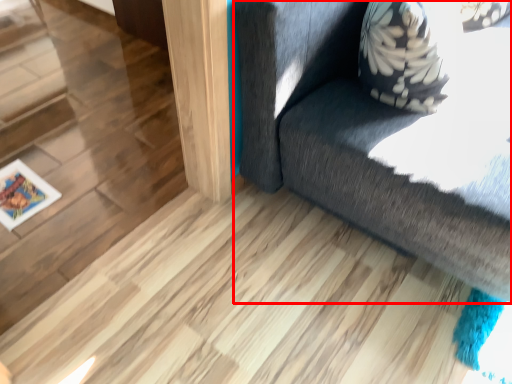
Question: From the image, what is the correct spatial relationship of furniture (annotated by the red box) in relation to picture frame?

Choices:
 (A) left
 (B) right

Answer: (B)